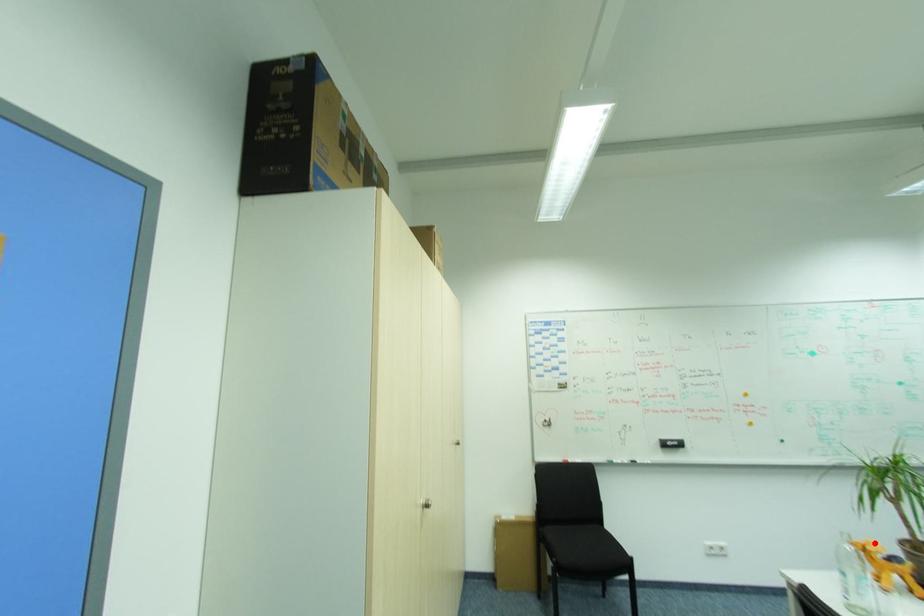
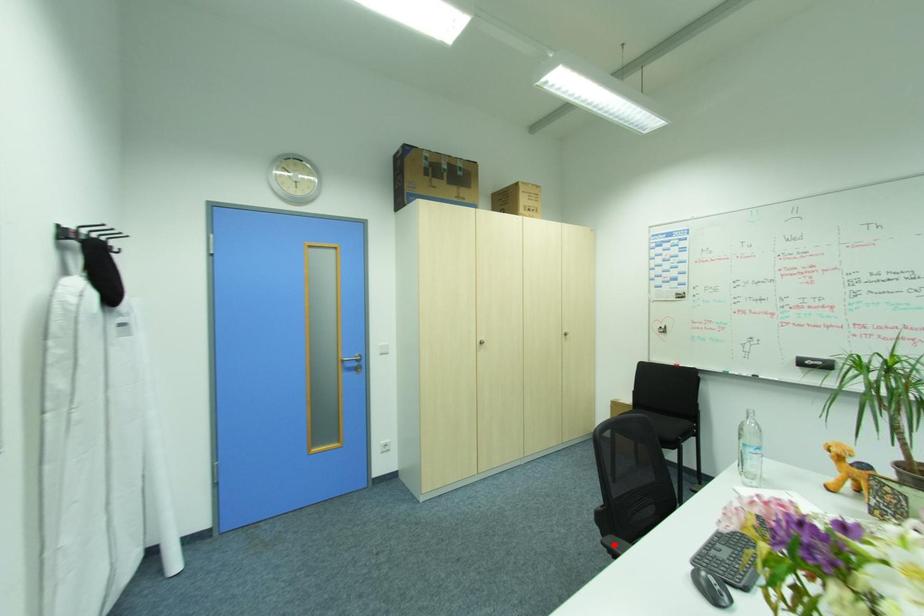
I am providing you with two images of the same scene from different viewpoints. A red point is marked on the first image and another point is marked on the second image. Are the points marked in image1 and image2 representing the same 3D position?

No